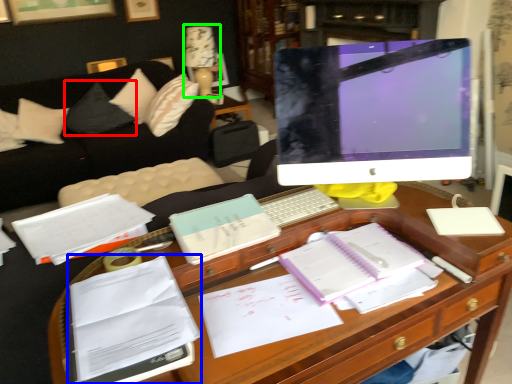
Question: Estimate the real-world distances between objects in this image. Which object is farther from pillow (highlighted by a red box), book (highlighted by a blue box) or table lamp (highlighted by a green box)?

Choices:
 (A) book
 (B) table lamp

Answer: (A)